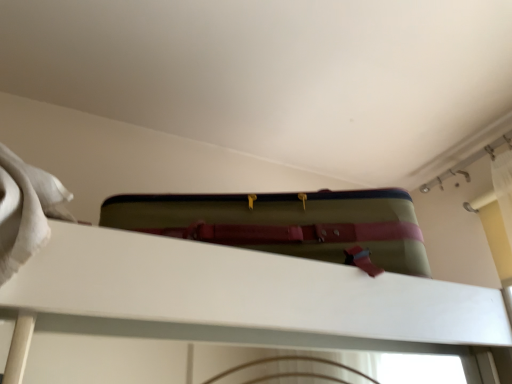
Where is `green fabric suitcase at center`? This screenshot has width=512, height=384. green fabric suitcase at center is located at coordinates (286, 224).

Looking at this image, measure the distance between green fabric suitcase at center and camera.

They are 29.04 inches apart.

Describe the element at coordinates (286, 224) in the screenshot. I see `green fabric suitcase at center` at that location.

You are a GUI agent. You are given a task and a screenshot of the screen. Output one action in this format:
    pyautogui.click(x=<x>, y=<y>)
    Task: Click on the green fabric suitcase at center
    Image resolution: width=512 pixels, height=384 pixels.
    Given the screenshot: What is the action you would take?
    pyautogui.click(x=286, y=224)